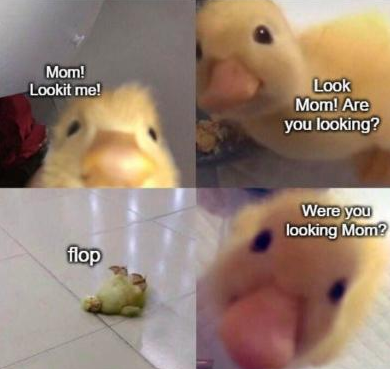
This screenshot has height=369, width=390. What are the coordinates of `beige floor tiles` in the screenshot? It's located at (16, 315), (98, 354), (163, 332), (158, 267), (187, 222), (157, 198), (72, 214), (6, 244).